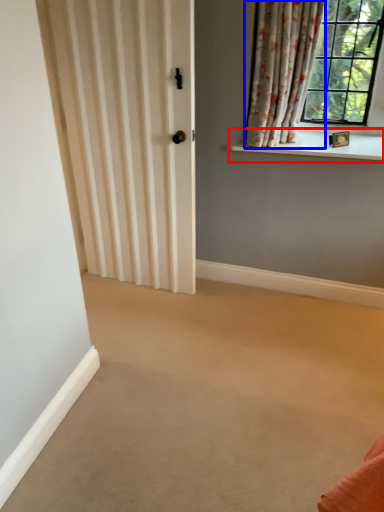
Question: Which object appears closest to the camera in this image, window sill (highlighted by a red box) or curtain (highlighted by a blue box)?

Choices:
 (A) window sill
 (B) curtain

Answer: (B)